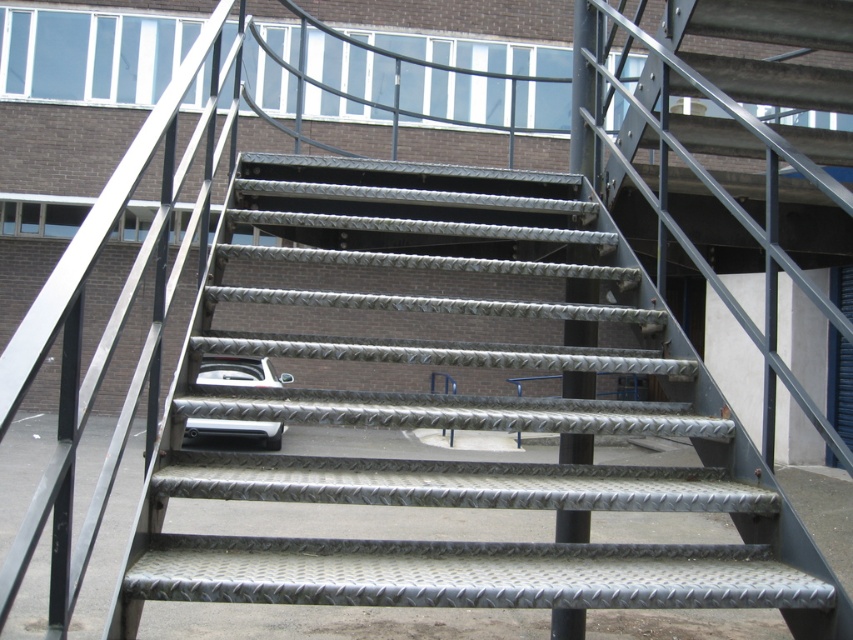
Does metallic textured stairs at center have a greater width compared to metallic silver car at center?

Yes, metallic textured stairs at center is wider than metallic silver car at center.

Which is behind, point (328, 497) or point (248, 376)?

The point (248, 376) is behind.

Who is more forward, (316, 314) or (274, 374)?

Positioned in front is point (274, 374).

I want to click on metallic textured stairs at center, so click(x=461, y=406).